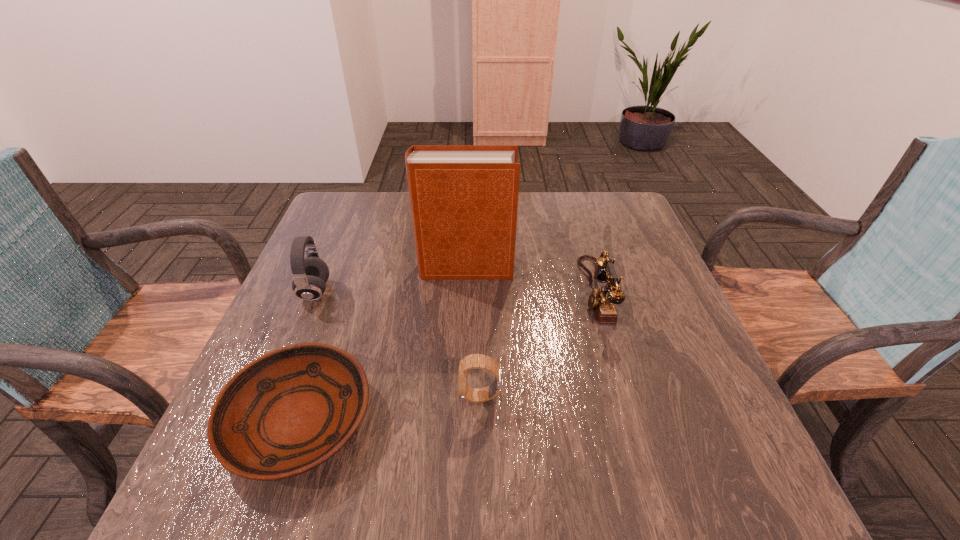
What are the coordinates of `vacant area that lies between the headset and the fourth tallest object` in the screenshot? It's located at (397, 344).

Identify the location of object that is the fourth closest to the shortest object. (602, 301).

Identify the location of object that can be found as the closest to the tallest object. The width and height of the screenshot is (960, 540). (602, 301).

This screenshot has height=540, width=960. In order to click on free location that satisfies the following two spatial constraints: 1. on the ear cups of the shortest object; 2. on the left side of the fourth shortest object in this screenshot , I will do `click(261, 420)`.

In order to click on free space that satisfies the following two spatial constraints: 1. on the ear cups of the second tallest object; 2. on the left side of the plate in this screenshot , I will do pos(261,420).